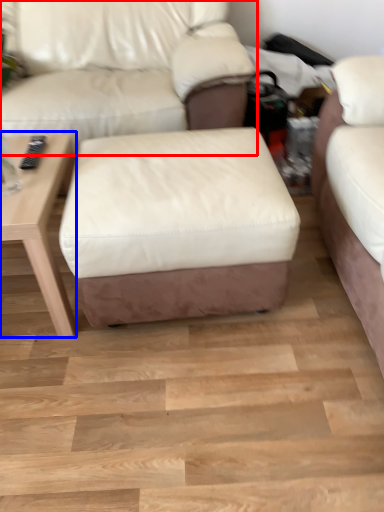
Question: Among these objects, which one is farthest to the camera, studio couch (highlighted by a red box) or table (highlighted by a blue box)?

Choices:
 (A) studio couch
 (B) table

Answer: (A)